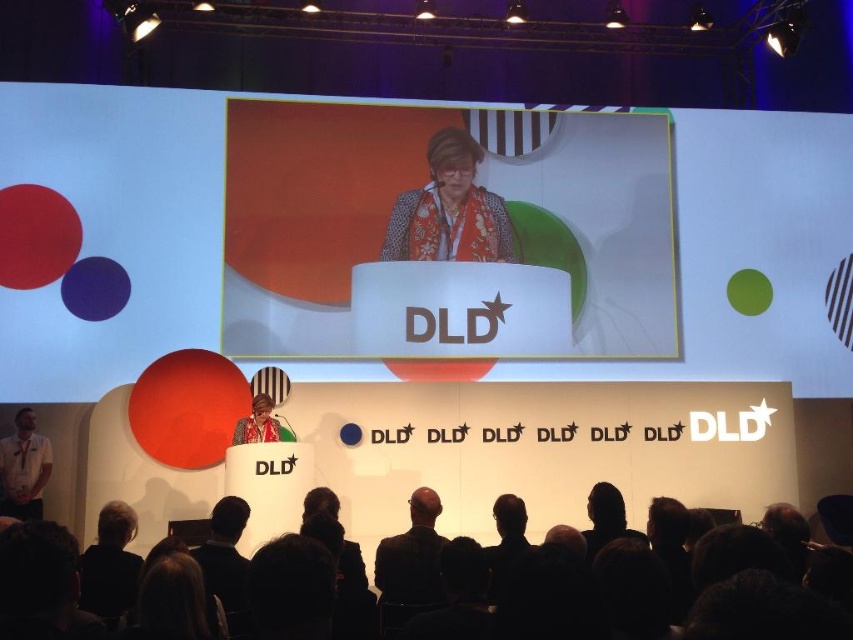
Based on the photo, which of these two, printed scarf at center or matte red scarf at center, stands shorter?

With less height is matte red scarf at center.

Between printed scarf at center and matte red scarf at center, which one has more height?

Standing taller between the two is printed scarf at center.

Locate an element on the screen. printed scarf at center is located at coordinates (450, 209).

Can you confirm if black fabric at lower center is bigger than matte red scarf at center?

Correct, black fabric at lower center is larger in size than matte red scarf at center.

This screenshot has width=853, height=640. What do you see at coordinates (764, 611) in the screenshot? I see `black fabric at lower center` at bounding box center [764, 611].

Does point (596, 592) come behind point (267, 420)?

That is False.

In order to click on black fabric at lower center in this screenshot , I will do `click(764, 611)`.

From the picture: Can you confirm if black fabric at lower center is taller than printed scarf at center?

Incorrect, black fabric at lower center's height is not larger of printed scarf at center's.

Looking at this image, can you confirm if black fabric at lower center is bigger than printed scarf at center?

No, black fabric at lower center is not bigger than printed scarf at center.

What do you see at coordinates (764, 611) in the screenshot?
I see `black fabric at lower center` at bounding box center [764, 611].

Identify the location of black fabric at lower center. (764, 611).